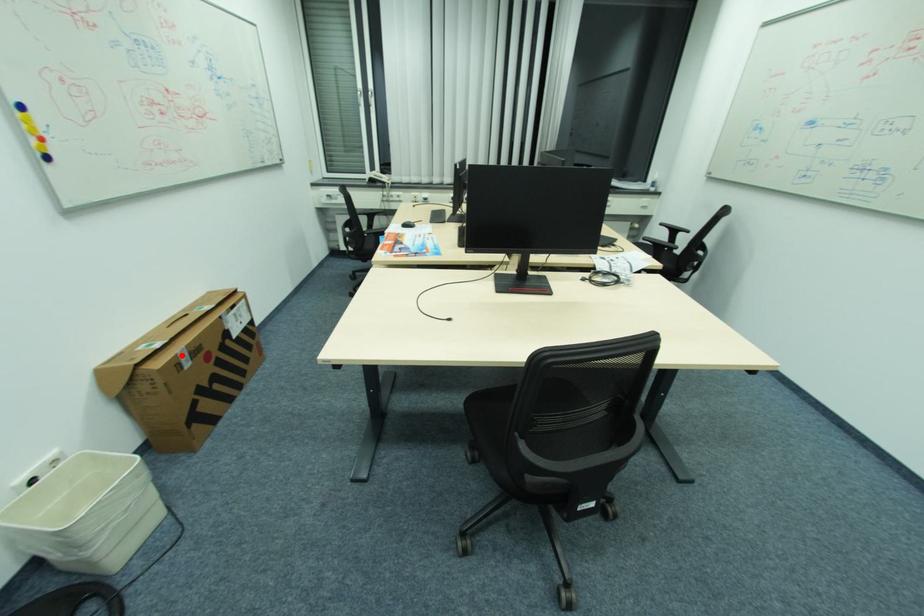
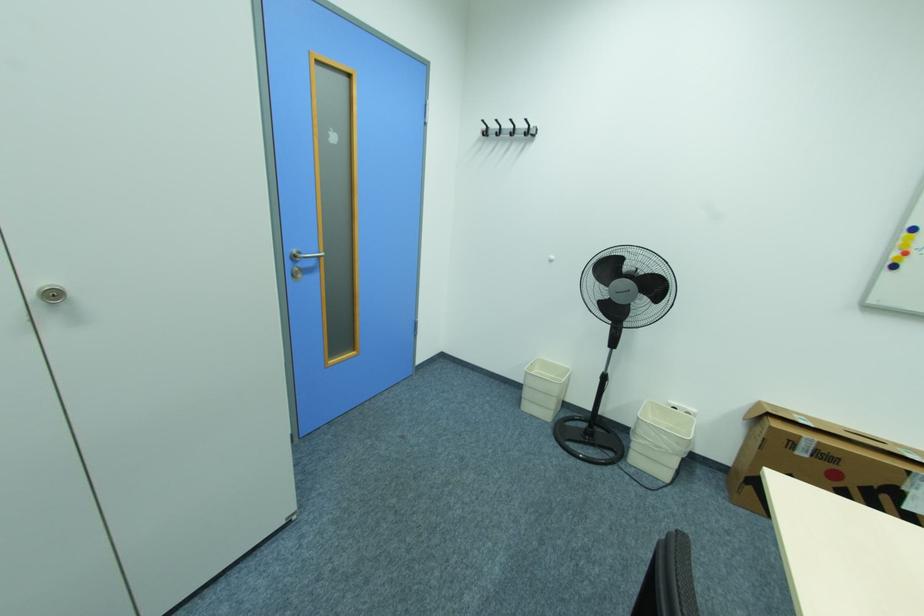
Where in the second image is the point corresponding to the highlighted location from the first image?

(805, 437)